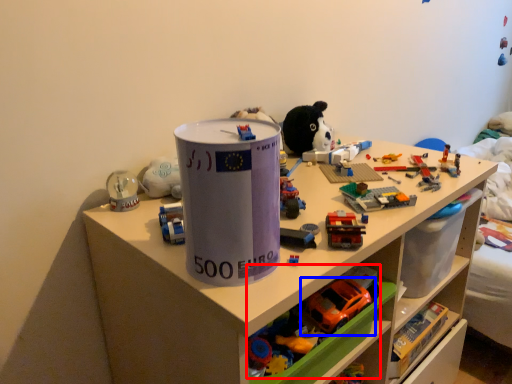
Question: Which of the following is the farthest to the observer, toy (highlighted by a red box) or toy (highlighted by a blue box)?

Choices:
 (A) toy
 (B) toy

Answer: (B)